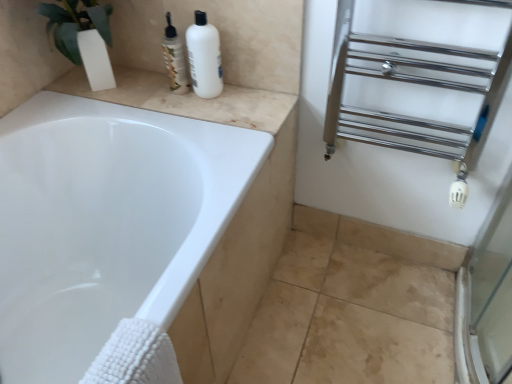
Locate an element on the screen. The image size is (512, 384). spots to the right of white matte bottle at upper center is located at coordinates (251, 100).